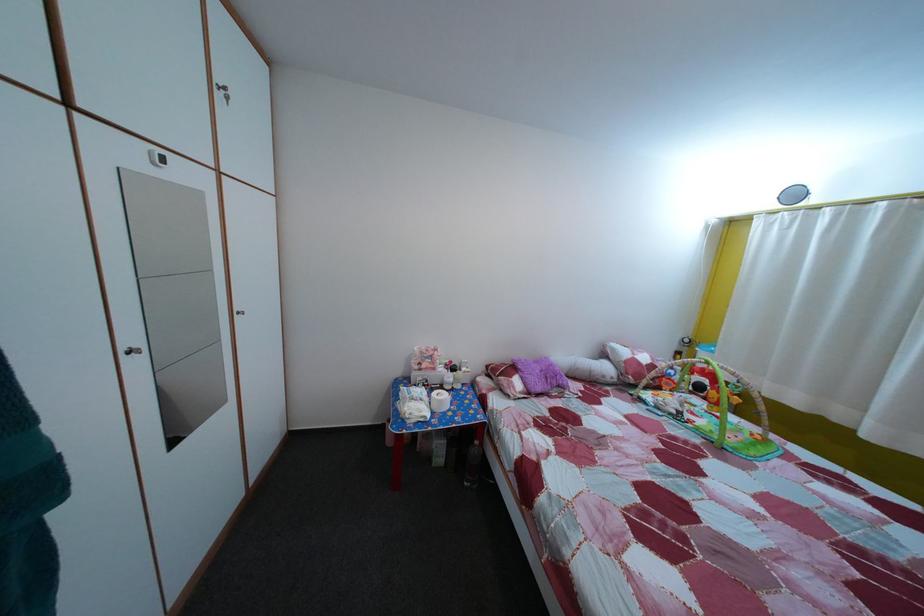
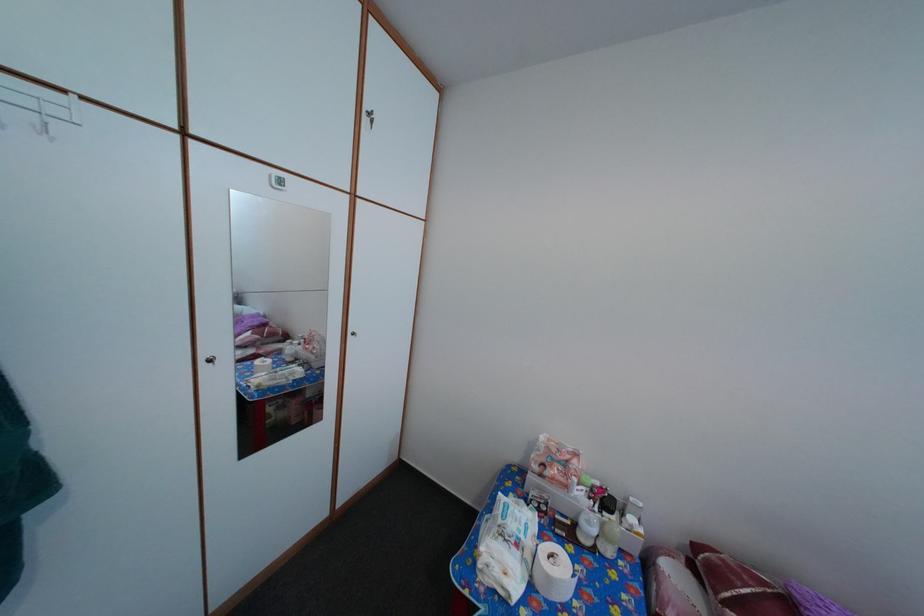
Question: I am providing you with two images of the same scene from different viewpoints. Which of the following objects are not visible in image2?

Choices:
 (A) package of diapers
 (B) white digital thermometer
 (C) white toilet roll
 (D) none of these

Answer: (D)